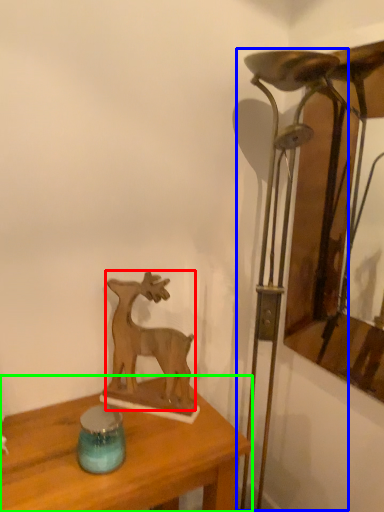
Question: Based on their relative distances, which object is farther from deer (highlighted by a red box)? Choose from table lamp (highlighted by a blue box) and table (highlighted by a green box).

Choices:
 (A) table lamp
 (B) table

Answer: (A)